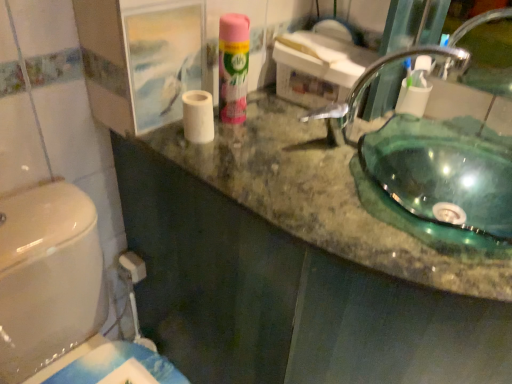
The image size is (512, 384). I want to click on vacant space in between transparent glass sink at upper right and white matte toilet paper at center, marked as the second toilet paper in a back-to-front arrangement, so click(x=279, y=150).